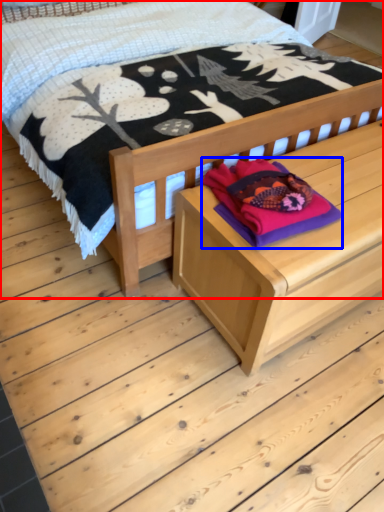
Question: Which object is closer to the camera taking this photo, bed (highlighted by a red box) or clothing (highlighted by a blue box)?

Choices:
 (A) bed
 (B) clothing

Answer: (A)